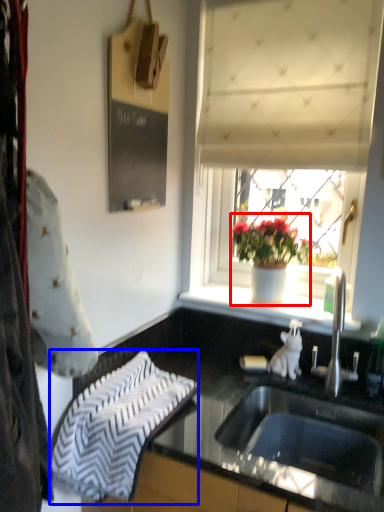
Question: Which of the following is the farthest to the observer, houseplant (highlighted by a red box) or beach towel (highlighted by a blue box)?

Choices:
 (A) houseplant
 (B) beach towel

Answer: (A)